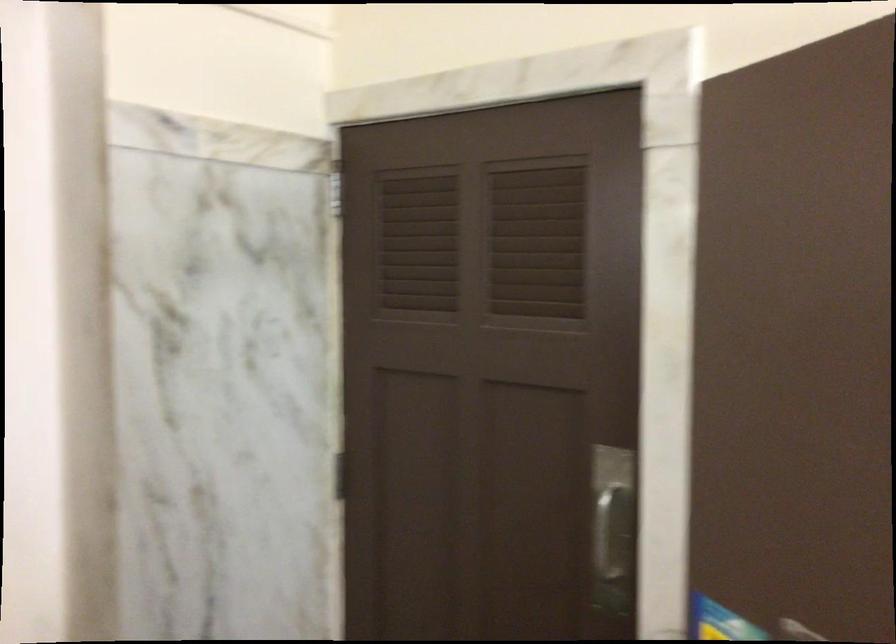
Where is `silver door handle`? This screenshot has width=896, height=644. silver door handle is located at coordinates (612, 543).